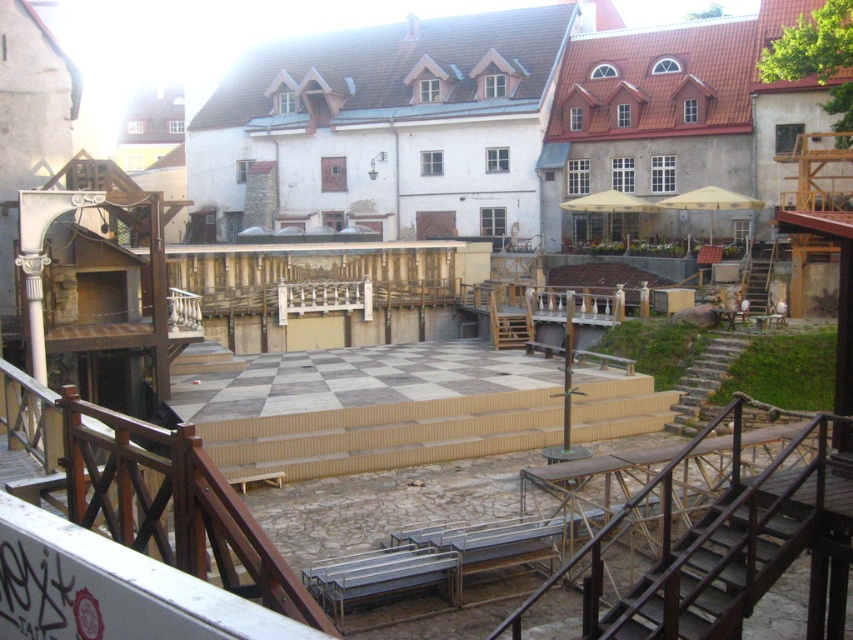
Is point (700, 595) positioned before point (692, 413)?

Yes, point (700, 595) is in front of point (692, 413).

Is point (723, 504) positioned in front of point (718, 371)?

Yes, it is in front of point (718, 371).

Find the location of a particular element. The width and height of the screenshot is (853, 640). dark brown wooden stairs at lower right is located at coordinates (721, 563).

Is stone stairs at right in front of wooden stairs at right?

Yes.

What do you see at coordinates (703, 380) in the screenshot? I see `stone stairs at right` at bounding box center [703, 380].

Between point (724, 340) and point (759, 248), which one is positioned in front?

Point (724, 340) is in front.

The height and width of the screenshot is (640, 853). I want to click on stone stairs at right, so click(x=703, y=380).

How far apart are dark brown wooden stairs at lower right and wooden stairs at right?

The distance of dark brown wooden stairs at lower right from wooden stairs at right is 22.82 meters.

Does dark brown wooden stairs at lower right appear on the right side of wooden stairs at right?

No, dark brown wooden stairs at lower right is not to the right of wooden stairs at right.

Identify the location of dark brown wooden stairs at lower right. (721, 563).

Find the location of a particular element. The width and height of the screenshot is (853, 640). dark brown wooden stairs at lower right is located at coordinates (721, 563).